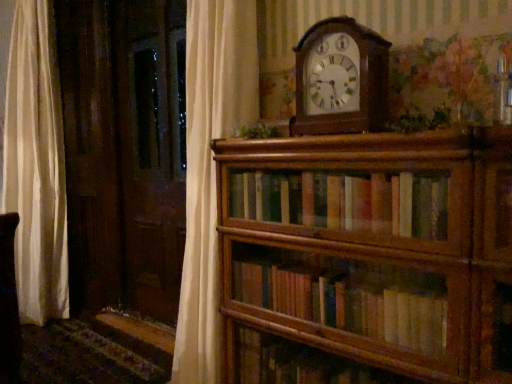
Question: Considering the relative positions of wooden wall clock at upper center and wooden bookshelf at center in the image provided, is wooden wall clock at upper center to the right of wooden bookshelf at center from the viewer's perspective?

Choices:
 (A) yes
 (B) no

Answer: (B)

Question: Is wooden wall clock at upper center next to wooden bookshelf at center?

Choices:
 (A) yes
 (B) no

Answer: (B)

Question: From a real-world perspective, is wooden wall clock at upper center physically below wooden bookshelf at center?

Choices:
 (A) yes
 (B) no

Answer: (B)

Question: Can we say wooden wall clock at upper center lies outside wooden bookshelf at center?

Choices:
 (A) yes
 (B) no

Answer: (A)

Question: Is wooden wall clock at upper center shorter than wooden bookshelf at center?

Choices:
 (A) yes
 (B) no

Answer: (A)

Question: Does wooden wall clock at upper center have a lesser width compared to wooden bookshelf at center?

Choices:
 (A) no
 (B) yes

Answer: (B)

Question: Is green leafy plant at upper center, the first plant viewed from the right, facing towards wooden bookshelf at center?

Choices:
 (A) yes
 (B) no

Answer: (B)

Question: Can you confirm if green leafy plant at upper center, positioned as the 1th plant in front-to-back order, is taller than wooden bookshelf at center?

Choices:
 (A) yes
 (B) no

Answer: (B)

Question: Is the depth of green leafy plant at upper center, which appears as the 2th plant when viewed from the left, greater than that of wooden bookshelf at center?

Choices:
 (A) yes
 (B) no

Answer: (A)

Question: Would you say green leafy plant at upper center, the first plant viewed from the right, contains wooden bookshelf at center?

Choices:
 (A) no
 (B) yes

Answer: (A)

Question: From a real-world perspective, is green leafy plant at upper center, the 2th plant positioned from the back, located beneath wooden bookshelf at center?

Choices:
 (A) no
 (B) yes

Answer: (A)

Question: Considering the relative sizes of green leafy plant at upper center, which appears as the 2th plant when viewed from the left, and wooden bookshelf at center in the image provided, is green leafy plant at upper center, which appears as the 2th plant when viewed from the left, shorter than wooden bookshelf at center?

Choices:
 (A) yes
 (B) no

Answer: (A)

Question: Could green leafy plant at upper center, the second plant in the front-to-back sequence, be considered to be inside wooden wall clock at upper center?

Choices:
 (A) no
 (B) yes

Answer: (A)